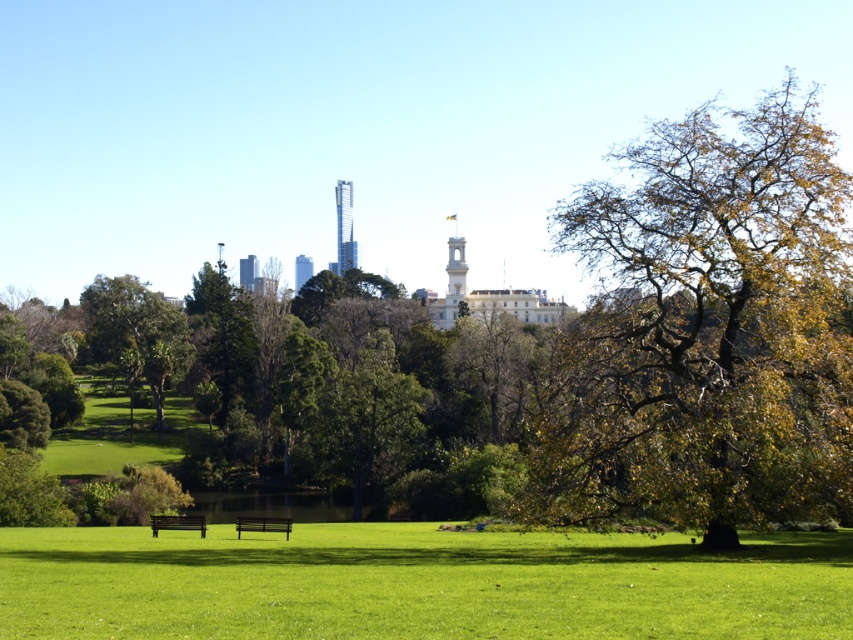
Who is positioned more to the right, green wooden bench at lower left or wooden bench at center?

Positioned to the right is wooden bench at center.

Does green wooden bench at lower left have a greater height compared to wooden bench at center?

Yes.

Is point (155, 518) farther from camera compared to point (281, 518)?

Yes, point (155, 518) is behind point (281, 518).

Find the location of a particular element. The width and height of the screenshot is (853, 640). green wooden bench at lower left is located at coordinates tap(177, 522).

Between green grassy field at lower center and smooth glass skyscraper at center, which one is positioned lower?

Positioned lower is green grassy field at lower center.

Is green grassy field at lower center bigger than smooth glass skyscraper at center?

Yes.

Is point (376, 595) farther from viewer compared to point (309, 269)?

That is False.

Identify the location of green grassy field at lower center. (416, 582).

Is wooden bench at center bigger than smooth glass skyscraper at center?

Actually, wooden bench at center might be smaller than smooth glass skyscraper at center.

Between point (236, 534) and point (310, 264), which one is positioned behind?

Positioned behind is point (310, 264).

Who is more forward, (282,522) or (299,273)?

Point (282,522) is in front.

At what (x,y) coordinates should I click in order to perform the action: click on wooden bench at center. Please return your answer as a coordinate pair (x, y). Looking at the image, I should click on (263, 524).